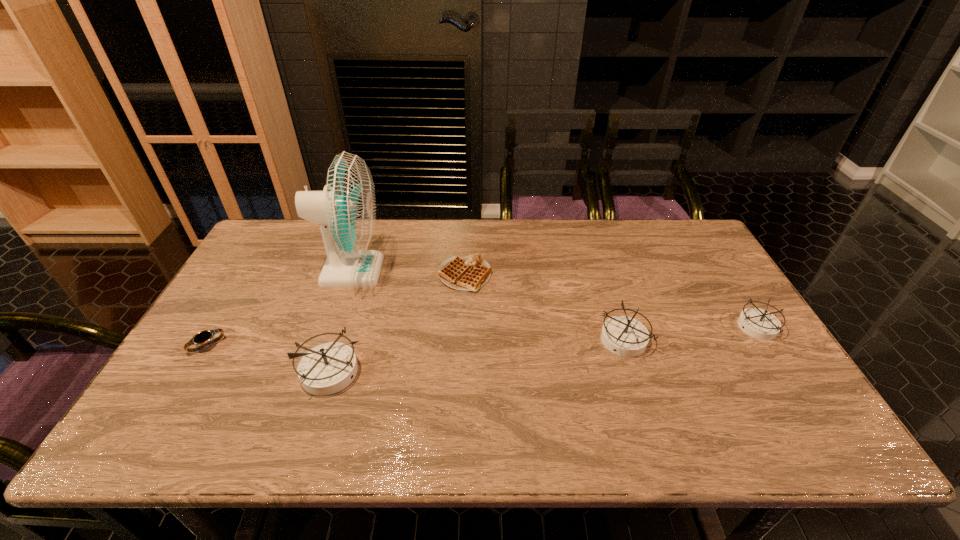
This screenshot has height=540, width=960. I want to click on empty space that is in between the fan and the watch, so click(x=279, y=308).

Locate an element on the screen. This screenshot has height=540, width=960. blank region between the leftmost object and the fan is located at coordinates (279, 308).

The image size is (960, 540). In order to click on free space between the second compass from right to left and the leftmost compass in this screenshot , I will do `click(477, 355)`.

You are a GUI agent. You are given a task and a screenshot of the screen. Output one action in this format:
    pyautogui.click(x=<x>, y=<y>)
    Task: Click on the blank region between the waffle and the third tallest object
    The height and width of the screenshot is (540, 960).
    Given the screenshot: What is the action you would take?
    pyautogui.click(x=544, y=308)

You are a GUI agent. You are given a task and a screenshot of the screen. Output one action in this format:
    pyautogui.click(x=<x>, y=<y>)
    Task: Click on the free space between the tallest object and the fifth object from left to right
    Image resolution: width=960 pixels, height=540 pixels.
    Given the screenshot: What is the action you would take?
    pyautogui.click(x=488, y=306)

Find the location of a particular element. Image resolution: width=960 pixels, height=540 pixels. vacant space that's between the leftmost compass and the third tallest object is located at coordinates (477, 355).

This screenshot has width=960, height=540. I want to click on the fourth closest object to the rightmost object, so click(x=345, y=210).

Locate which object ranks fourth in proximity to the second tallest compass. Please provide its 2D coordinates. Your answer should be formatted as a tuple, i.e. [(x, y)], where the tuple contains the x and y coordinates of a point satisfying the conditions above.

[(345, 210)]

Select which compass appears as the second closest to the watch. Please provide its 2D coordinates. Your answer should be formatted as a tuple, i.e. [(x, y)], where the tuple contains the x and y coordinates of a point satisfying the conditions above.

[(624, 336)]

At what (x,y) coordinates should I click in order to perform the action: click on the third closest compass to the fan. Please return your answer as a coordinate pair (x, y). The width and height of the screenshot is (960, 540). Looking at the image, I should click on (758, 323).